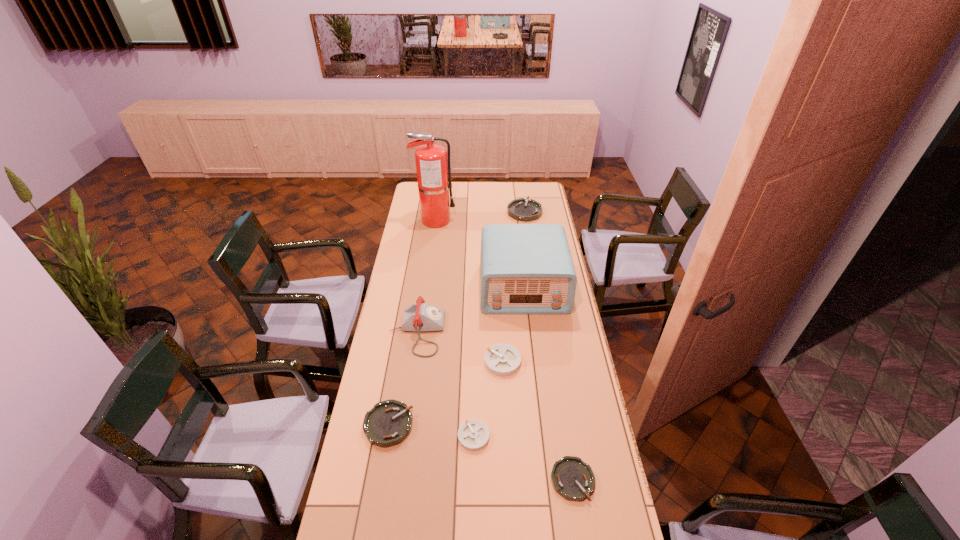
In the image, there is a desktop. Where is `blank space at the right edge`? This screenshot has width=960, height=540. blank space at the right edge is located at coordinates (610, 519).

Locate an element on the screen. blank space at the far right corner is located at coordinates (540, 185).

At what (x,y) coordinates should I click in order to perform the action: click on free space between the telephone and the farthest ashtray. Please return your answer as a coordinate pair (x, y). The height and width of the screenshot is (540, 960). Looking at the image, I should click on (470, 272).

Where is `vacant area that lies between the sixth shortest object and the radio receiver`? This screenshot has width=960, height=540. vacant area that lies between the sixth shortest object and the radio receiver is located at coordinates (470, 309).

At what (x,y) coordinates should I click in order to perform the action: click on free space that is in between the smaller gray ashtray and the farthest ashtray. Please return your answer as a coordinate pair (x, y). Looking at the image, I should click on (499, 324).

In order to click on free space between the radio receiver and the second farthest green ashtray in this screenshot , I will do `click(456, 356)`.

At what (x,y) coordinates should I click in order to perform the action: click on empty location between the nearest ashtray and the smaller gray ashtray. Please return your answer as a coordinate pair (x, y). Looking at the image, I should click on (523, 458).

Image resolution: width=960 pixels, height=540 pixels. Identify the location of free area in between the second farthest ashtray and the fire extinguisher. (468, 291).

I want to click on object that is the sixth closest to the radio receiver, so click(x=473, y=435).

Select which object is the second closest to the farthest green ashtray. Please provide its 2D coordinates. Your answer should be formatted as a tuple, i.e. [(x, y)], where the tuple contains the x and y coordinates of a point satisfying the conditions above.

[(527, 269)]